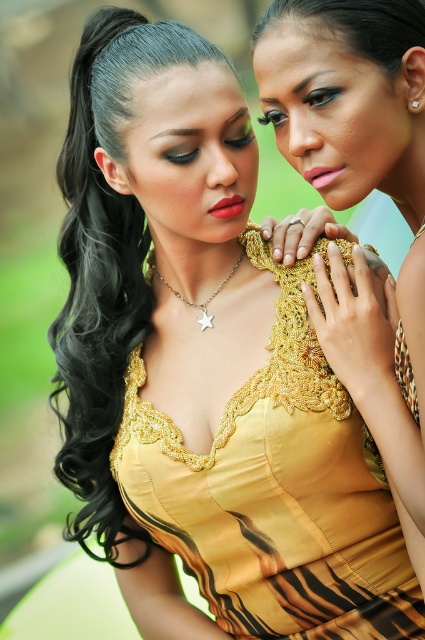
Question: Is pink matte lipstick at center smaller than diamondelegant metal at upper right?

Choices:
 (A) no
 (B) yes

Answer: (A)

Question: Among these objects, which one is farthest from the camera?

Choices:
 (A) pink matte lipstick at center
 (B) matte pink lipstick at center

Answer: (B)

Question: Among these objects, which one is nearest to the camera?

Choices:
 (A) satin gold dress at center
 (B) diamondelegant metal at upper right
 (C) pink matte lipstick at center

Answer: (A)

Question: Which object is positioned closest to the matte pink lipstick at center?

Choices:
 (A) gold metallic star at center
 (B) black shiny hair at left

Answer: (A)

Question: Is satin gold dress at center wider than gold metallic star at center?

Choices:
 (A) no
 (B) yes

Answer: (B)

Question: Can you confirm if black shiny hair at left is thinner than pink matte lipstick at center?

Choices:
 (A) no
 (B) yes

Answer: (A)